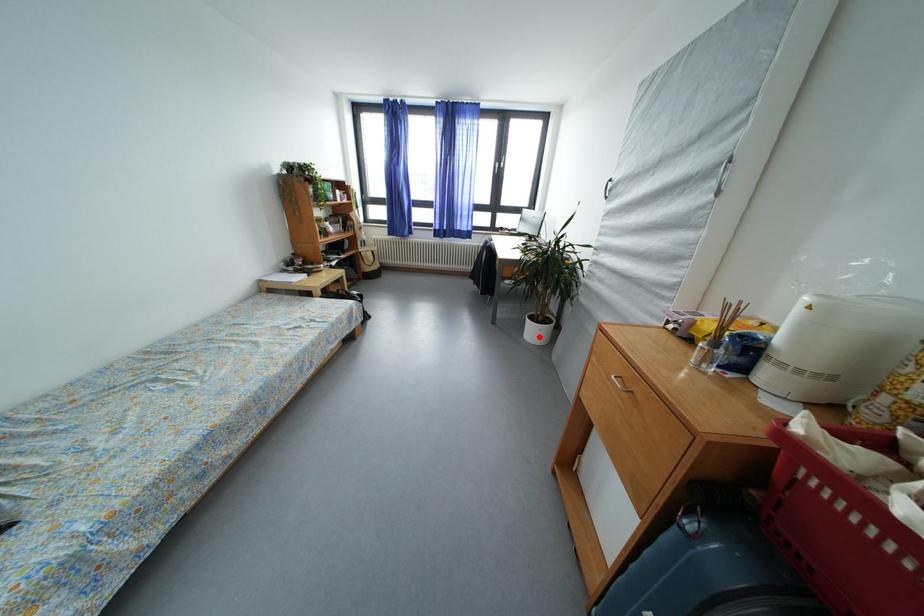
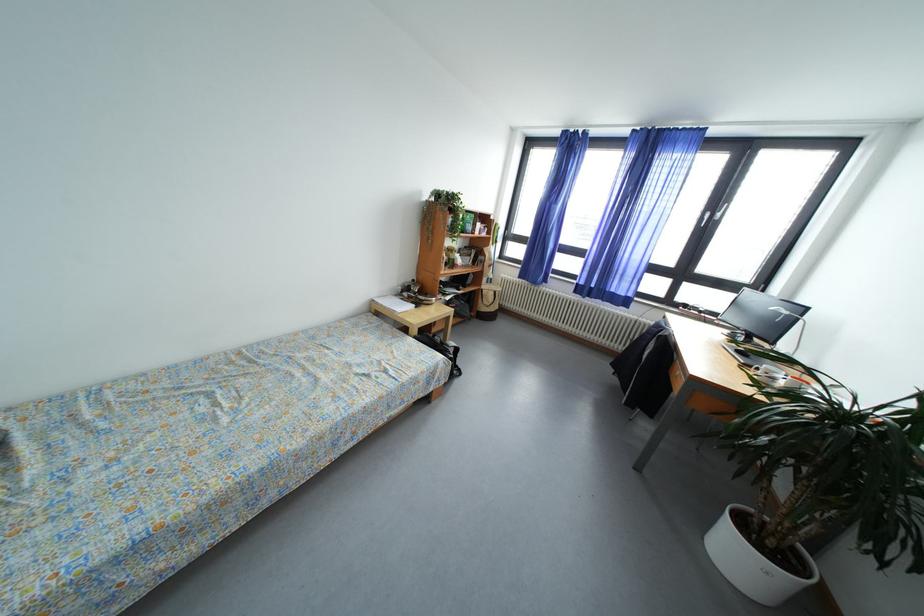
In the second image, find the point that corresponds to the highlighted location in the first image.

(745, 561)